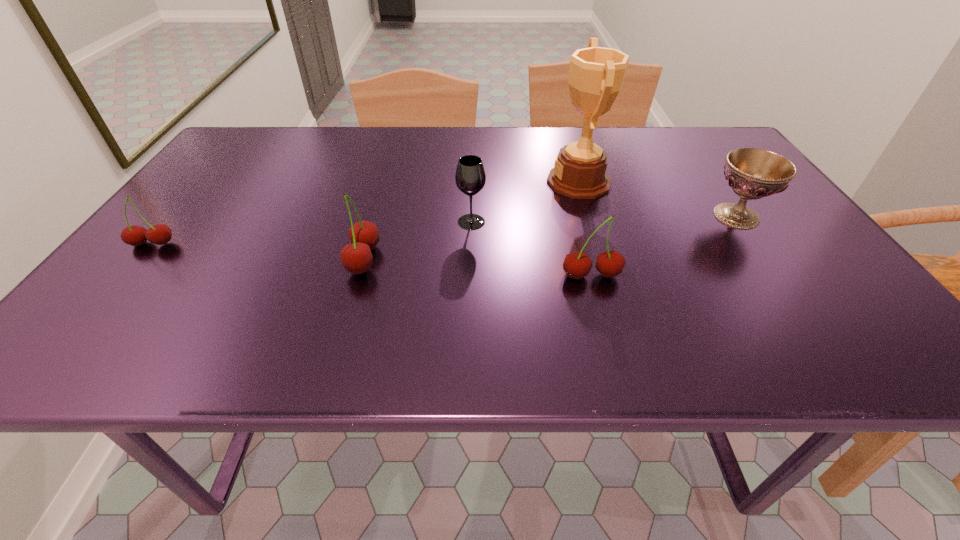
Locate an element on the screen. This screenshot has width=960, height=540. object that is at the right edge is located at coordinates point(752,173).

This screenshot has height=540, width=960. In the image, there is a desktop. What are the coordinates of `vacant region at the far edge` in the screenshot? It's located at (577, 131).

This screenshot has height=540, width=960. I want to click on vacant space at the near edge of the desktop, so click(647, 294).

Where is `vacant space at the far left corner of the desktop`? The height and width of the screenshot is (540, 960). vacant space at the far left corner of the desktop is located at coordinates 283,133.

At what (x,y) coordinates should I click in order to perform the action: click on vacant area that lies between the chalice and the second object from left to right. Please return your answer as a coordinate pair (x, y). This screenshot has height=540, width=960. Looking at the image, I should click on (550, 238).

The image size is (960, 540). Identify the location of empty space that is in between the wineglass and the chalice. (604, 219).

Where is `free space that is in between the tallest object and the rightmost object`? This screenshot has height=540, width=960. free space that is in between the tallest object and the rightmost object is located at coordinates (658, 199).

Where is `free spot between the rightmost object and the award`? This screenshot has width=960, height=540. free spot between the rightmost object and the award is located at coordinates (658, 199).

What are the coordinates of `free space between the rightmost object and the rightmost cherry` in the screenshot? It's located at (663, 246).

This screenshot has height=540, width=960. In order to click on vacant point located between the award and the rightmost object in this screenshot , I will do `click(658, 199)`.